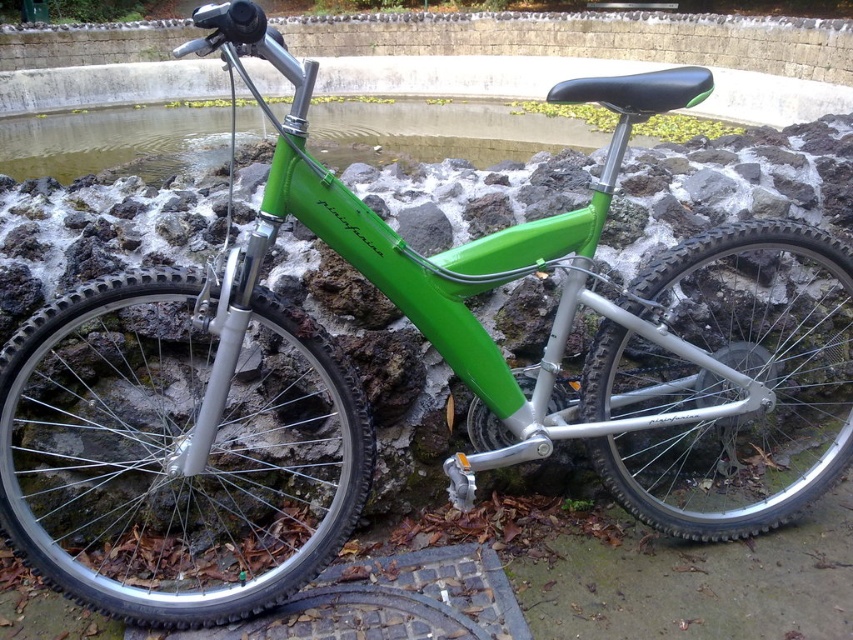
You are a photographer trying to capture the green rubber tire at center and the green matte water at upper center in a single shot. Which object will appear smaller in the photo?

The green rubber tire at center appears smaller in the photo because it occupies less space than the green matte water at upper center.

You are a delivery robot positioned at point 0.5,0.5 in the image coordinate system. You need to move to the green rubber tire at lower left. Which direction should you move first?

The green rubber tire at lower left is located at point (173, 452). Since the robot is at (426, 320), it should move towards the right and down to reach the tire.